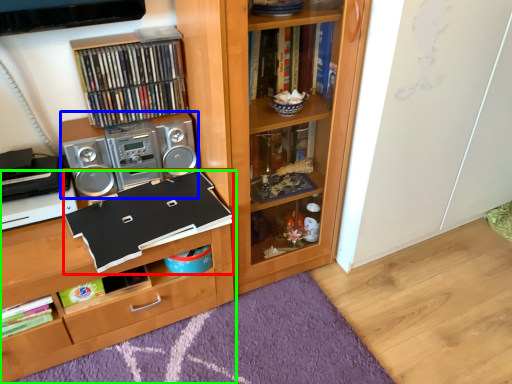
Question: Estimate the real-world distances between objects in this image. Which object is farther from book (highlighted by a red box), stereo (highlighted by a blue box) or shelf (highlighted by a green box)?

Choices:
 (A) stereo
 (B) shelf

Answer: (A)